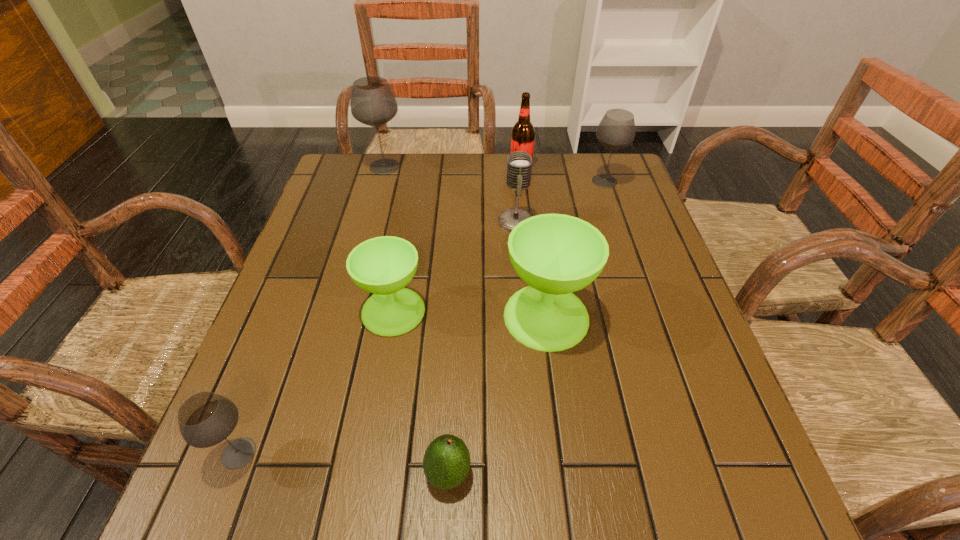
The image size is (960, 540). Identify the location of the second gray wineglass from right to left. (372, 103).

At what (x,y) coordinates should I click in order to perform the action: click on the tallest wineglass. Please return your answer as a coordinate pair (x, y). Looking at the image, I should click on (372, 103).

Image resolution: width=960 pixels, height=540 pixels. What are the coordinates of `root beer` in the screenshot? It's located at (523, 133).

Image resolution: width=960 pixels, height=540 pixels. I want to click on the rightmost gray wineglass, so click(x=616, y=130).

Find the location of `the rightmost object`. the rightmost object is located at coordinates (616, 130).

The image size is (960, 540). I want to click on the fourth wineglass from left to right, so click(x=556, y=254).

The image size is (960, 540). Find the location of `the right green wineglass`. the right green wineglass is located at coordinates (556, 254).

I want to click on microphone, so click(x=519, y=163).

Where is `gray microphone`? The image size is (960, 540). gray microphone is located at coordinates (519, 163).

Where is `the smaller green wineglass`? The height and width of the screenshot is (540, 960). the smaller green wineglass is located at coordinates (384, 265).